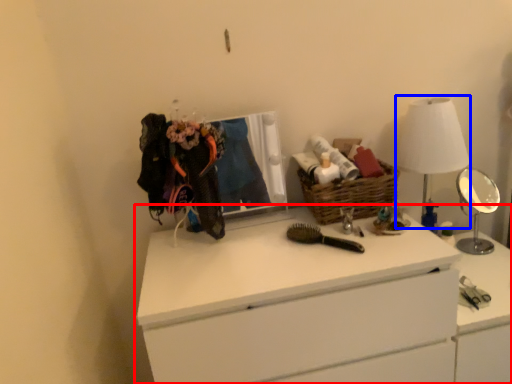
Question: Which point is further to the camera, chest of drawers (highlighted by a red box) or table lamp (highlighted by a blue box)?

Choices:
 (A) chest of drawers
 (B) table lamp

Answer: (B)